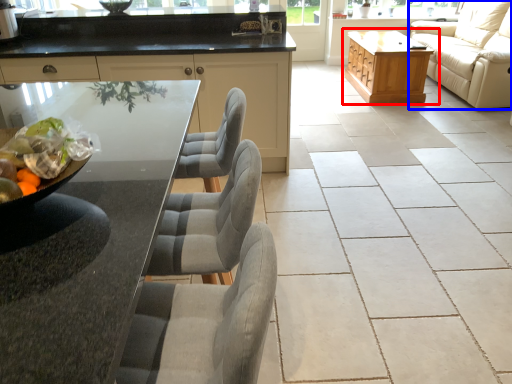
Question: Which point is further to the camera, table (highlighted by a red box) or studio couch (highlighted by a blue box)?

Choices:
 (A) table
 (B) studio couch

Answer: (A)